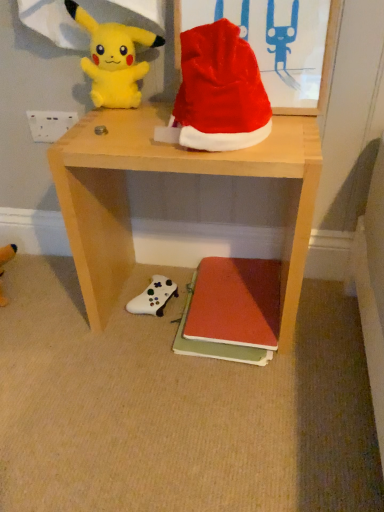
This screenshot has width=384, height=512. I want to click on free space to the left of matte red book at lower center, so click(133, 332).